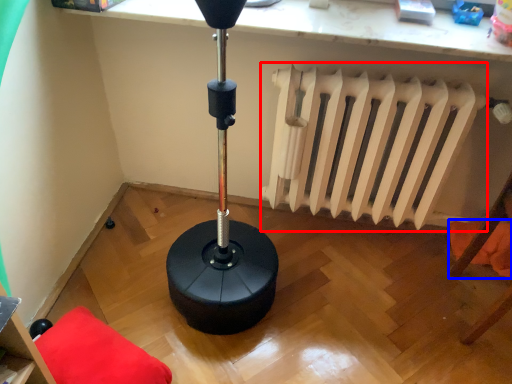
Question: Which object appears closest to the camera in this image, radiator (highlighted by a red box) or pillow (highlighted by a blue box)?

Choices:
 (A) radiator
 (B) pillow

Answer: (A)